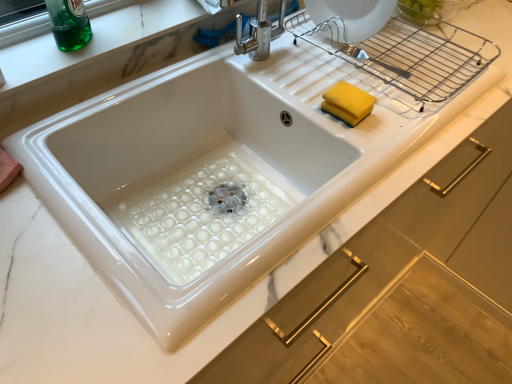
Question: Would you say white glossy sink at center is outside green glass bottle at upper left?

Choices:
 (A) no
 (B) yes

Answer: (B)

Question: From the image's perspective, would you say white glossy sink at center is shown under green glass bottle at upper left?

Choices:
 (A) no
 (B) yes

Answer: (B)

Question: Considering the relative sizes of white glossy sink at center and green glass bottle at upper left in the image provided, is white glossy sink at center taller than green glass bottle at upper left?

Choices:
 (A) no
 (B) yes

Answer: (A)

Question: Is white glossy sink at center further to camera compared to green glass bottle at upper left?

Choices:
 (A) yes
 (B) no

Answer: (B)

Question: Does white glossy sink at center come in front of green glass bottle at upper left?

Choices:
 (A) yes
 (B) no

Answer: (A)

Question: Is white glossy sink at center at the right side of green glass bottle at upper left?

Choices:
 (A) yes
 (B) no

Answer: (A)

Question: Can you see yellow sponge at upper right touching green glass bottle at upper left?

Choices:
 (A) yes
 (B) no

Answer: (B)

Question: Considering the relative sizes of yellow sponge at upper right and green glass bottle at upper left in the image provided, is yellow sponge at upper right smaller than green glass bottle at upper left?

Choices:
 (A) yes
 (B) no

Answer: (A)

Question: Considering the relative sizes of yellow sponge at upper right and green glass bottle at upper left in the image provided, is yellow sponge at upper right taller than green glass bottle at upper left?

Choices:
 (A) no
 (B) yes

Answer: (A)

Question: From a real-world perspective, is yellow sponge at upper right under green glass bottle at upper left?

Choices:
 (A) no
 (B) yes

Answer: (B)

Question: Does yellow sponge at upper right have a lesser width compared to green glass bottle at upper left?

Choices:
 (A) no
 (B) yes

Answer: (A)

Question: Does yellow sponge at upper right turn towards green glass bottle at upper left?

Choices:
 (A) no
 (B) yes

Answer: (A)

Question: Are yellow sponge at upper right and white glossy sink at center located far from each other?

Choices:
 (A) no
 (B) yes

Answer: (A)